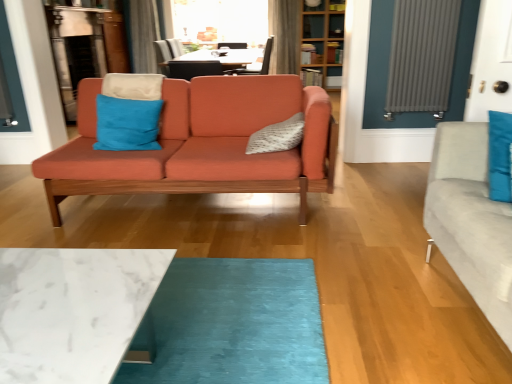
Question: Considering the positions of point (296, 26) and point (115, 97), is point (296, 26) closer or farther from the camera than point (115, 97)?

Choices:
 (A) closer
 (B) farther

Answer: (B)

Question: Relative to blue suede pillow at center, arranged as the 2th pillow when viewed from the right, is velvet gray curtain at upper center, arranged as the second curtain when viewed from the left, in front or behind?

Choices:
 (A) front
 (B) behind

Answer: (B)

Question: Estimate the real-world distances between objects in this image. Which object is farther from the transparent glass window screen at upper center?

Choices:
 (A) velvet gray curtain at upper center, arranged as the second curtain when viewed from the left
 (B) gray ribbed radiator at right
 (C) textured gray pillow at center, the 1th pillow from the right
 (D) wooden bookshelf at upper center
 (E) matte black chair at upper center

Answer: (C)

Question: Which of these objects is positioned farthest from the textured gray pillow at center, the 1th pillow from the right?

Choices:
 (A) wooden bookshelf at upper center
 (B) velvet gray curtain at upper center, the first curtain viewed from the right
 (C) matte orange couch at center
 (D) silky gray curtain at upper center, which is the second curtain in right-to-left order
 (E) matte black chair at upper center

Answer: (B)